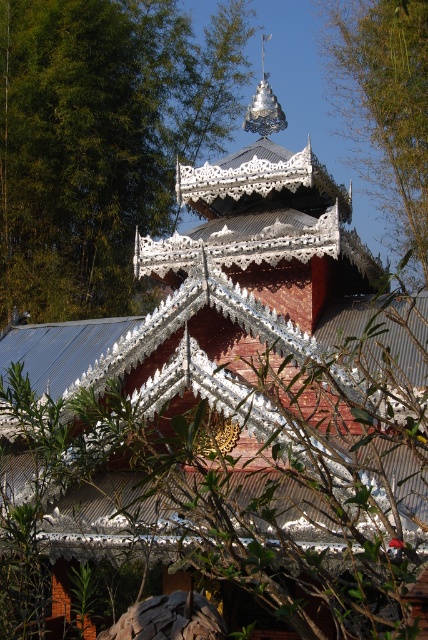
You are standing in front of the temple and want to take a photo. You notice two points marked in the scene. The first point is at coordinate point (92, 252) and the second is at point (407, 93). Which point is closer to your camera lens?

Point (92, 252) is further to the camera than point (407, 93), so the point closer to the camera lens is point (407, 93).

You are an architect designing a garden layout and need to place two green leafy trees. You have a space that can accommodate a tree up to 3 meters wide. The green leafy tree at upper left and the green leafy tree at upper center are options. Which tree should you choose to fit in the space?

The green leafy tree at upper center should be chosen because its width is smaller than the green leafy tree at upper left, making it suitable for the 3 meter space.